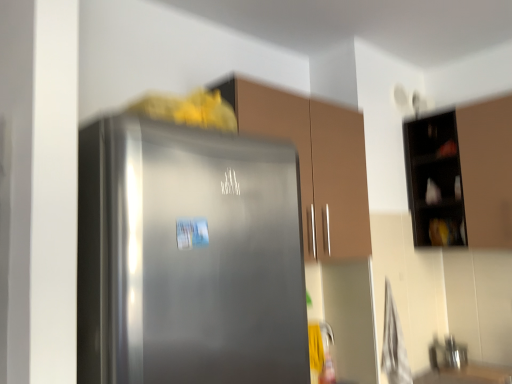
Question: Is matte brown cabinet at center, the second cabinetry when ordered from right to left, in front of or behind black matte cabinet at upper right, which appears as the 2th cabinetry when viewed from the left, in the image?

Choices:
 (A) behind
 (B) front

Answer: (B)

Question: Is matte brown cabinet at center, the second cabinetry when ordered from right to left, inside the boundaries of black matte cabinet at upper right, which appears as the 2th cabinetry when viewed from the left, or outside?

Choices:
 (A) inside
 (B) outside

Answer: (B)

Question: Estimate the real-world distances between objects in this image. Which object is farther from the smooth wooden counter top at lower right?

Choices:
 (A) satin silver refrigerator at center
 (B) metallic stainless steel sink at lower right
 (C) black matte cabinet at upper right, which appears as the 2th cabinetry when viewed from the left
 (D) matte brown cabinet at center, the second cabinetry when ordered from right to left

Answer: (A)

Question: Estimate the real-world distances between objects in this image. Which object is closer to the matte brown cabinet at center, the first cabinetry positioned from the left?

Choices:
 (A) satin silver refrigerator at center
 (B) black matte cabinet at upper right, which is the 1th cabinetry from right to left
 (C) metallic stainless steel sink at lower right
 (D) smooth wooden counter top at lower right

Answer: (A)